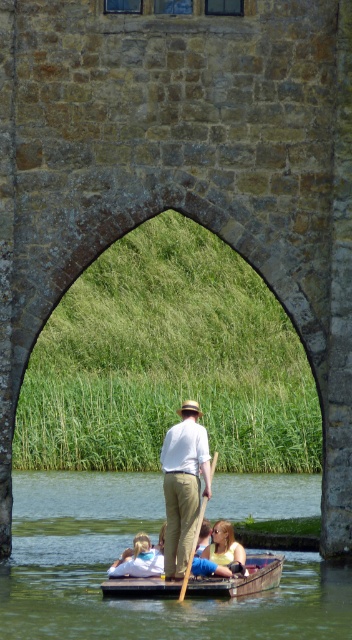
Who is taller, light brown hair at center or wooden at center?

With more height is wooden at center.

Is light brown hair at center to the left of wooden at center from the viewer's perspective?

Indeed, light brown hair at center is positioned on the left side of wooden at center.

Between point (129, 550) and point (204, 502), which one is positioned in front?

Positioned in front is point (204, 502).

At what (x,y) coordinates should I click in order to perform the action: click on light brown hair at center. Please return your answer as a coordinate pair (x, y). The image size is (352, 640). Looking at the image, I should click on (139, 560).

Based on the photo, who is lower down, green smooth water at center or light brown hair at center?

green smooth water at center

Which is in front, point (83, 490) or point (139, 564)?

Point (139, 564)

At what (x,y) coordinates should I click in order to perform the action: click on green smooth water at center. Please return your answer as a coordinate pair (x, y). This screenshot has width=352, height=640. Looking at the image, I should click on (117, 556).

Who is higher up, blonde hair at center or wooden at center?

wooden at center

Can you confirm if blonde hair at center is thinner than wooden at center?

Indeed, blonde hair at center has a lesser width compared to wooden at center.

Does point (212, 556) come behind point (216, 454)?

That is False.

Where is `blonde hair at center`? The image size is (352, 640). blonde hair at center is located at coordinates (223, 547).